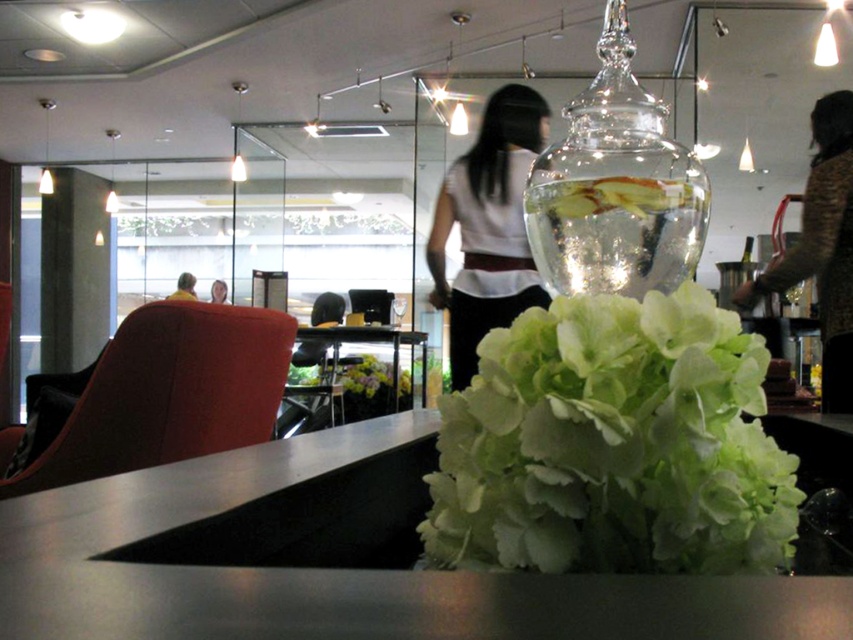
Can you confirm if transparent glass fishbowl at upper center is wider than smooth yellow shirt at center?

In fact, transparent glass fishbowl at upper center might be narrower than smooth yellow shirt at center.

Can you confirm if transparent glass fishbowl at upper center is bigger than smooth yellow shirt at center?

No, transparent glass fishbowl at upper center is not bigger than smooth yellow shirt at center.

Between point (680, 180) and point (212, 285), which one is positioned behind?

Point (212, 285)

The image size is (853, 640). What are the coordinates of `transparent glass fishbowl at upper center` in the screenshot? It's located at (614, 186).

Is metallic black table at center shorter than smooth yellow shirt at center?

Incorrect, metallic black table at center's height does not fall short of smooth yellow shirt at center's.

Is metallic black table at center positioned behind smooth yellow shirt at center?

No, it is in front of smooth yellow shirt at center.

Does point (360, 339) come closer to viewer compared to point (225, 304)?

No, it is not.

Find the location of `metallic black table at center`. metallic black table at center is located at coordinates (369, 342).

Which is above, transparent glass fishbowl at upper center or white matte shirt at center?

white matte shirt at center

Based on the photo, between transparent glass fishbowl at upper center and white matte shirt at center, which one is positioned lower?

transparent glass fishbowl at upper center is below.

This screenshot has width=853, height=640. I want to click on transparent glass fishbowl at upper center, so click(614, 186).